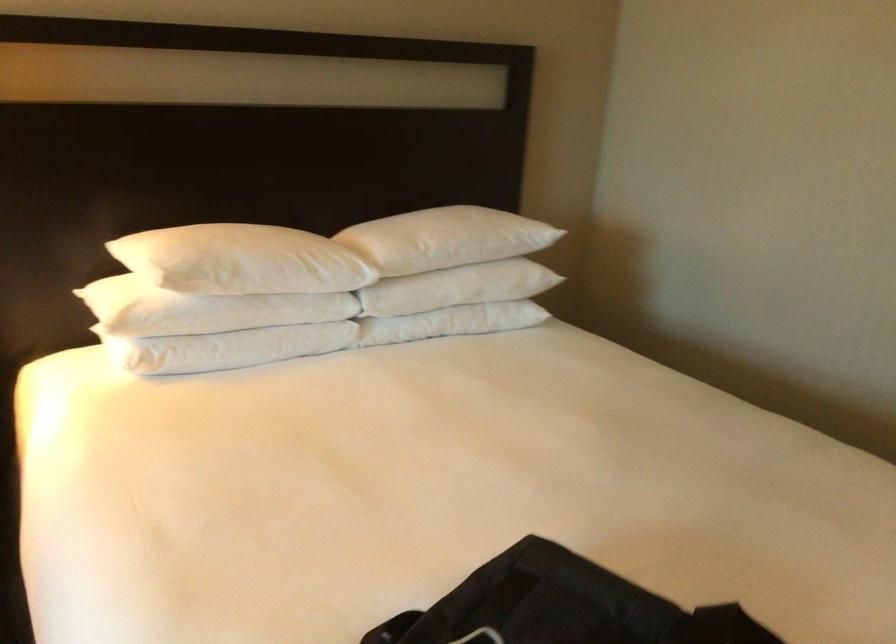
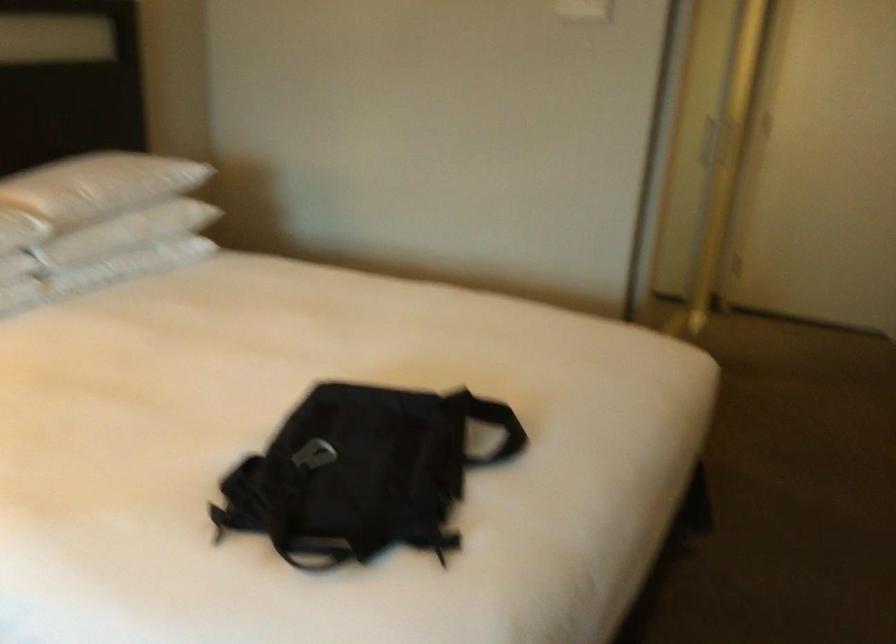
Question: How did the camera likely rotate?

Choices:
 (A) Left
 (B) Right
 (C) Up
 (D) Down

Answer: (B)